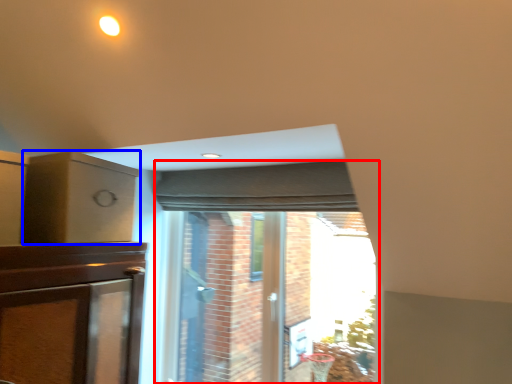
Question: Which object is closer to the camera taking this photo, bay window (highlighted by a red box) or cabinetry (highlighted by a blue box)?

Choices:
 (A) bay window
 (B) cabinetry

Answer: (B)